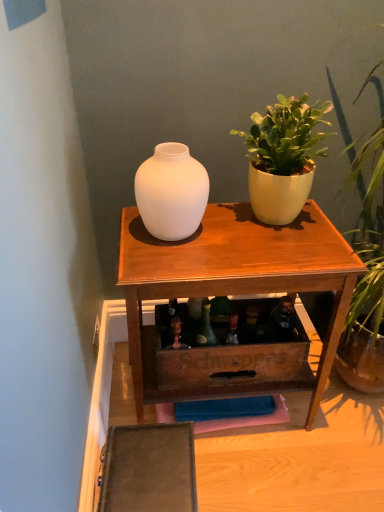
Question: Can you confirm if matte white vase at center is shorter than matte yellow pot at upper right?

Choices:
 (A) no
 (B) yes

Answer: (B)

Question: Is matte white vase at center not near matte yellow pot at upper right?

Choices:
 (A) yes
 (B) no

Answer: (B)

Question: Is the surface of matte white vase at center in direct contact with matte yellow pot at upper right?

Choices:
 (A) yes
 (B) no

Answer: (B)

Question: Does matte white vase at center have a larger size compared to matte yellow pot at upper right?

Choices:
 (A) no
 (B) yes

Answer: (A)

Question: Is matte white vase at center further to camera compared to matte yellow pot at upper right?

Choices:
 (A) no
 (B) yes

Answer: (B)

Question: Considering the positions of matte white vase at center and matte white vase at upper center in the image, is matte white vase at center bigger or smaller than matte white vase at upper center?

Choices:
 (A) small
 (B) big

Answer: (A)

Question: Visually, is matte white vase at center positioned to the left or to the right of matte white vase at upper center?

Choices:
 (A) right
 (B) left

Answer: (B)

Question: Is matte white vase at center in front of or behind matte white vase at upper center in the image?

Choices:
 (A) front
 (B) behind

Answer: (A)

Question: Would you say matte white vase at center is inside or outside matte white vase at upper center?

Choices:
 (A) inside
 (B) outside

Answer: (B)

Question: Is matte yellow pot at upper right in front of or behind matte white vase at center in the image?

Choices:
 (A) behind
 (B) front

Answer: (B)

Question: From the image's perspective, is matte yellow pot at upper right above or below matte white vase at center?

Choices:
 (A) below
 (B) above

Answer: (B)

Question: Is matte yellow pot at upper right taller or shorter than matte white vase at center?

Choices:
 (A) tall
 (B) short

Answer: (A)

Question: From a real-world perspective, is matte yellow pot at upper right physically located above or below matte white vase at center?

Choices:
 (A) below
 (B) above

Answer: (B)

Question: Considering the positions of point (150, 207) and point (288, 180), is point (150, 207) closer or farther from the camera than point (288, 180)?

Choices:
 (A) farther
 (B) closer

Answer: (B)

Question: Looking at the image, does matte white vase at center seem bigger or smaller compared to matte yellow pot at upper right?

Choices:
 (A) big
 (B) small

Answer: (B)